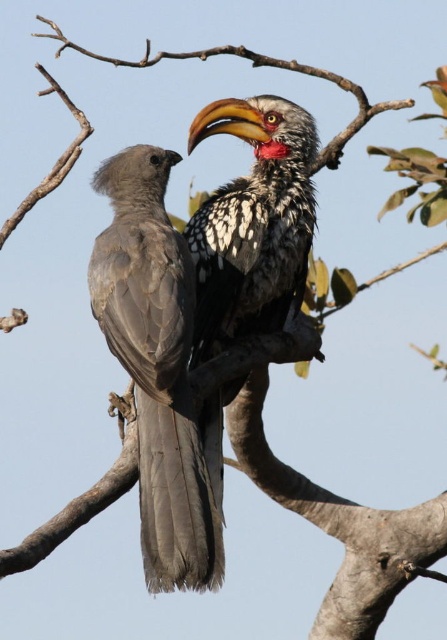
You are an ornithologist observing two birds on a branch. You have a camera with a zoom lens and want to take a clear photo of the speckled feathered hornbill at center without the gray matte bird at center blocking it. Is this possible given their positions?

The gray matte bird at center is closer to the viewer than the speckled feathered hornbill at center. Therefore, the gray matte bird at center would block the view of the speckled feathered hornbill at center, making it impossible to take a clear photo without the obstruction.

You are observing two points in a scene with two birds on a branch. The points are labeled as point 1 at coordinates point (138, 189) and point 2 at coordinates point (195, 221). Which point is closer to you?

Point (138, 189) is closer to the viewer than point (195, 221).

You are a birdwatcher trying to identify the birds in the image. You notice a gray matte bird at center at point (x=156, y=365). Which bird is located at that point?

The gray matte bird at center is located at point (x=156, y=365).